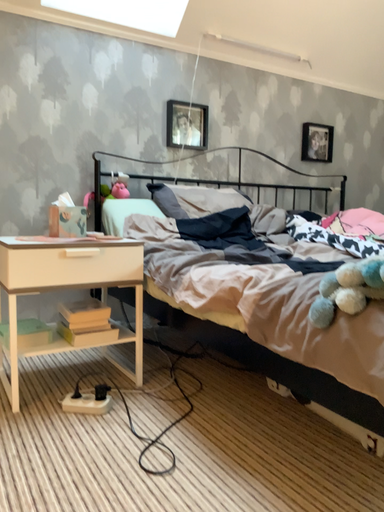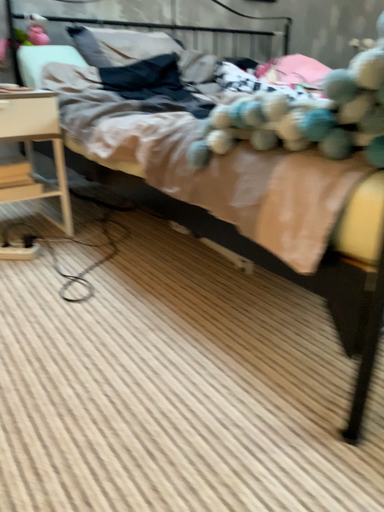
Question: Which way did the camera rotate in the video?

Choices:
 (A) rotated downward
 (B) rotated upward

Answer: (A)